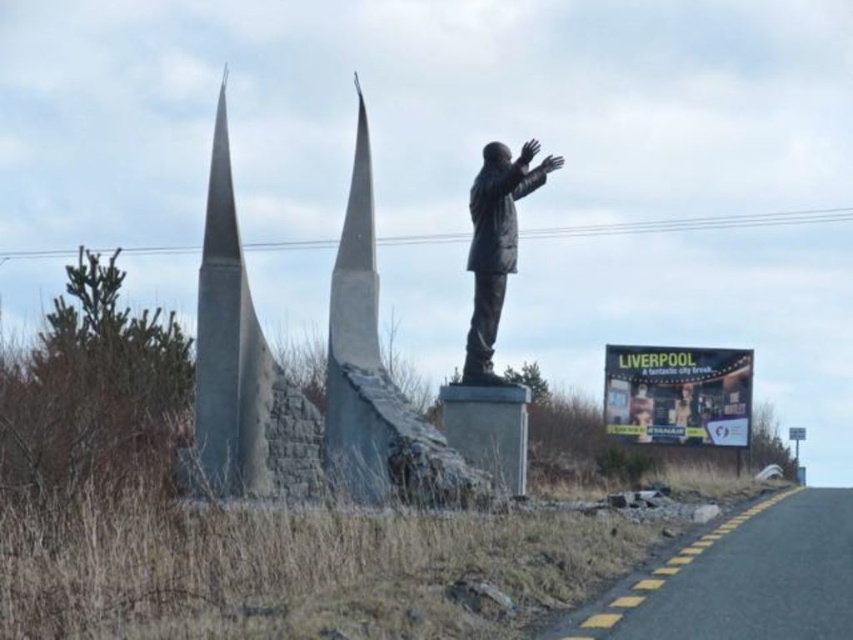
In the scene shown: Who is more forward, (732,445) or (514,186)?

Point (514,186)

Can you confirm if yellow billboard at right is positioned below bronze statue at center?

Yes, yellow billboard at right is below bronze statue at center.

Locate an element on the screen. The width and height of the screenshot is (853, 640). yellow billboard at right is located at coordinates point(677,394).